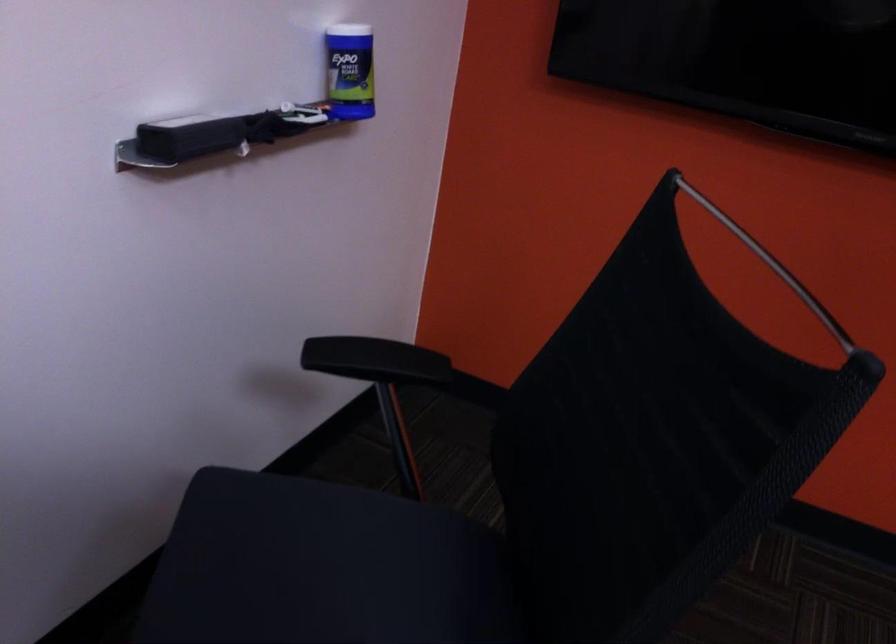
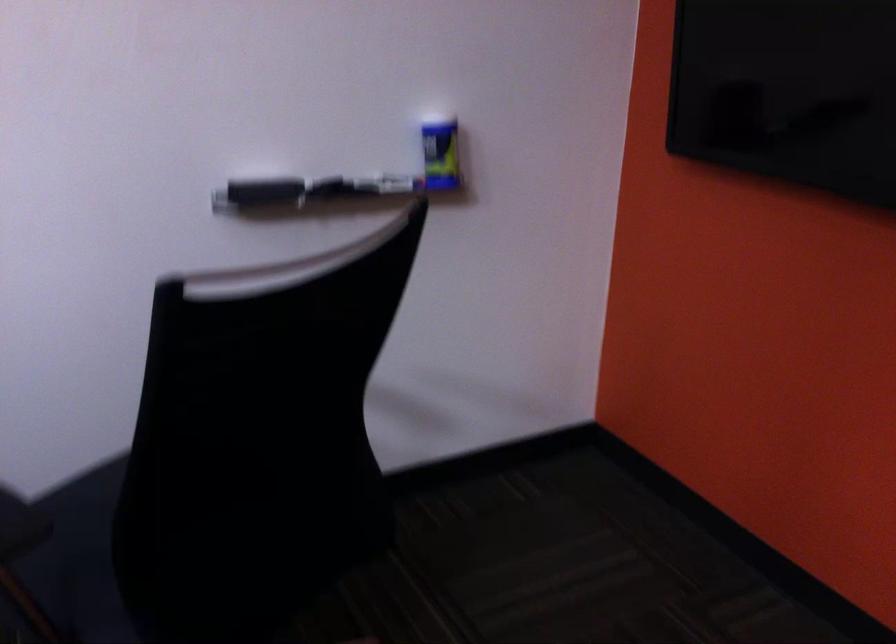
Question: How did the camera likely rotate?

Choices:
 (A) Left
 (B) Right
 (C) Up
 (D) Down

Answer: (A)